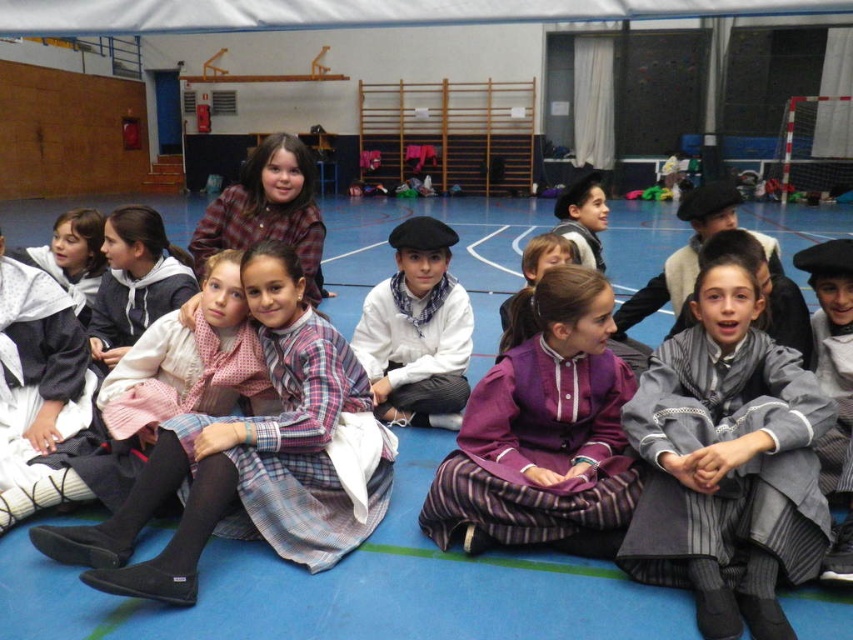
Question: Which point is closer to the camera?

Choices:
 (A) (194, 237)
 (B) (451, 358)
 (C) (105, 580)

Answer: (C)

Question: Observing the image, what is the correct spatial positioning of plaid fabric dress at center in reference to white matte shirt at center?

Choices:
 (A) below
 (B) above

Answer: (A)

Question: In this image, where is purple satin dress at center located relative to plaid fabric shirt at upper center?

Choices:
 (A) right
 (B) left

Answer: (A)

Question: Is plaid fabric dress at center wider than purple satin dress at center?

Choices:
 (A) no
 (B) yes

Answer: (B)

Question: Which point is closer to the camera?

Choices:
 (A) purple satin dress at center
 (B) plaid fabric dress at center
 (C) plaid fabric shirt at upper center

Answer: (B)

Question: Among these points, which one is nearest to the camera?

Choices:
 (A) (257, 240)
 (B) (44, 554)
 (C) (352, 330)

Answer: (B)